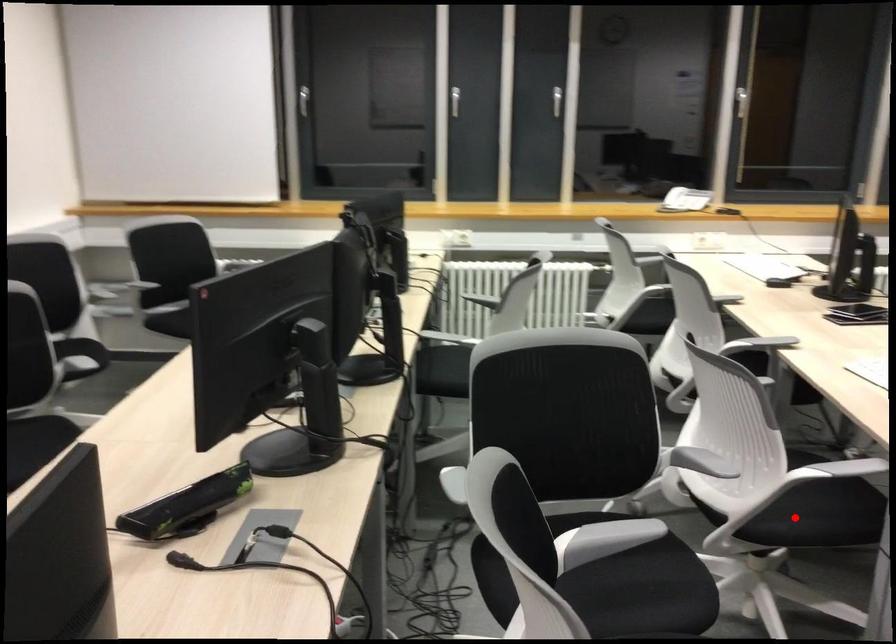
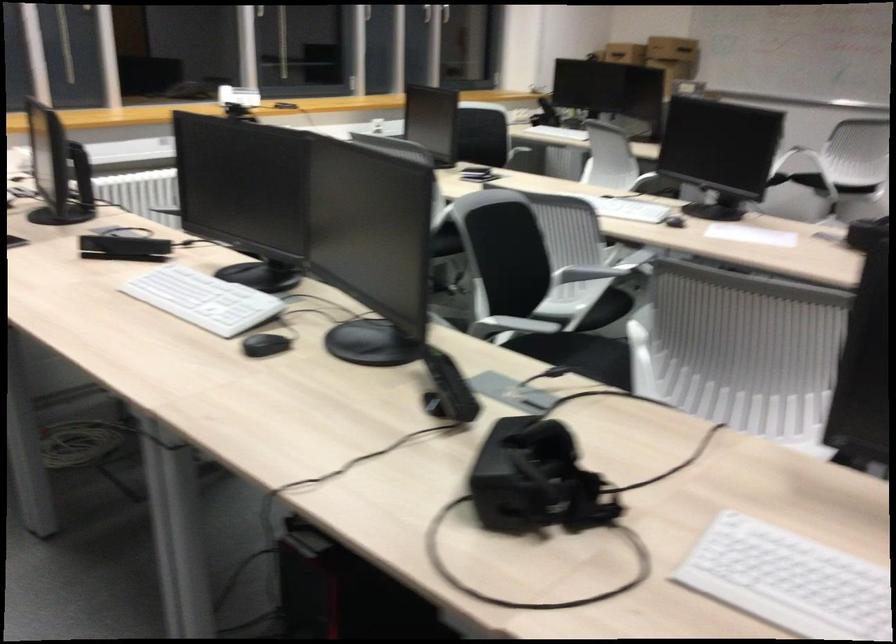
Question: I am providing you with two images of the same scene from different viewpoints. Image1 has a red point marked. In image2, the corresponding 3D location appears at what relative position? Reply with the corresponding letter.

Choices:
 (A) Closer
 (B) Farther

Answer: (B)